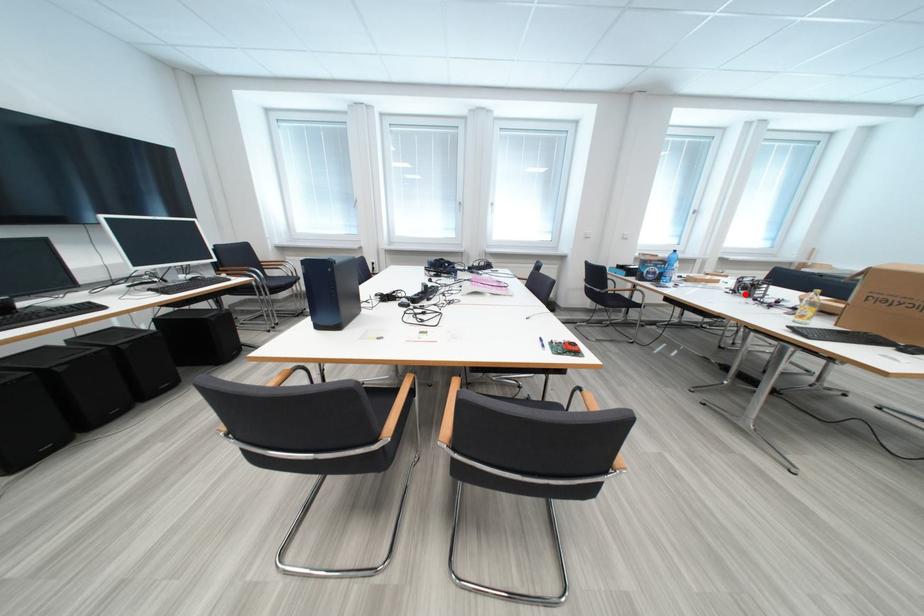
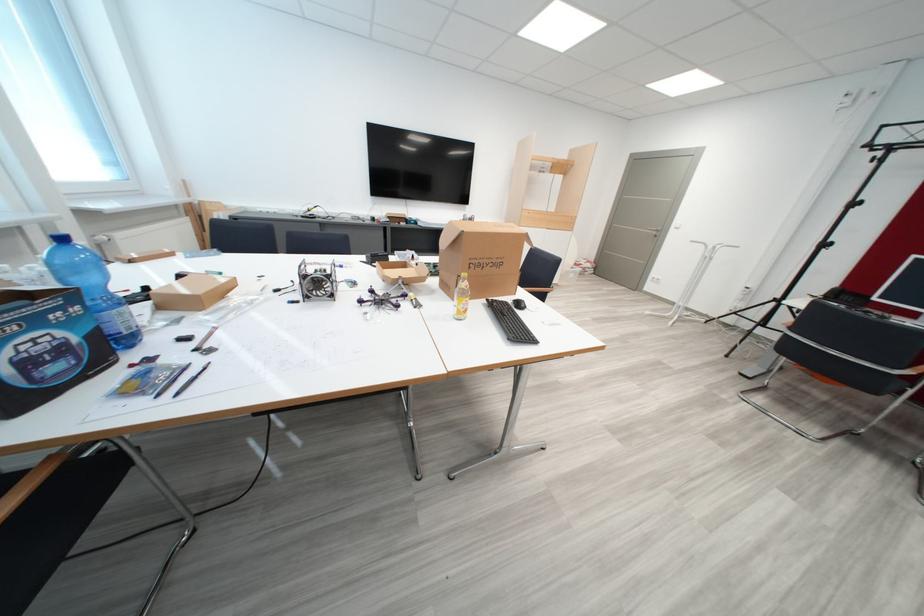
The point at the highlighted location is marked in the first image. Where is the corresponding point in the second image?

(317, 300)